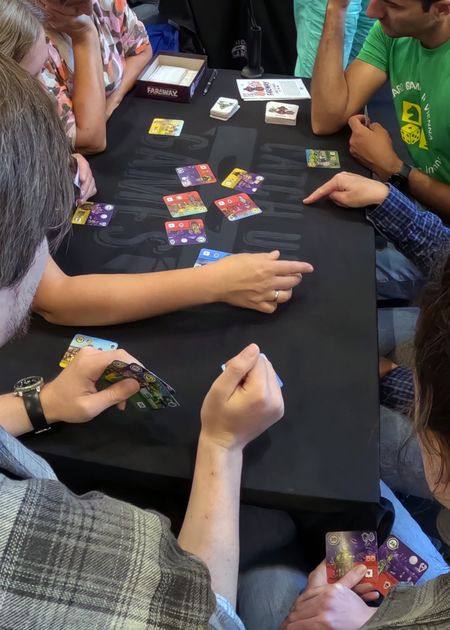
You are a GUI agent. You are given a task and a screenshot of the screen. Output one action in this format:
    pyautogui.click(x=<x>, y=<y>)
    Task: Click on the board game box sitting on left corner of table
    
    Given the screenshot: What is the action you would take?
    179,87